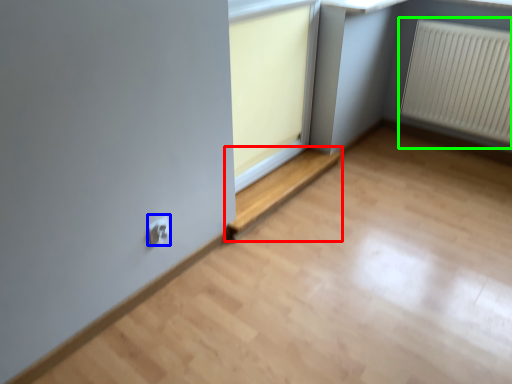
Question: Which object is the farthest from window (highlighted by a red box)? Choose among these: electric outlet (highlighted by a blue box) or radiator (highlighted by a green box).

Choices:
 (A) electric outlet
 (B) radiator

Answer: (B)